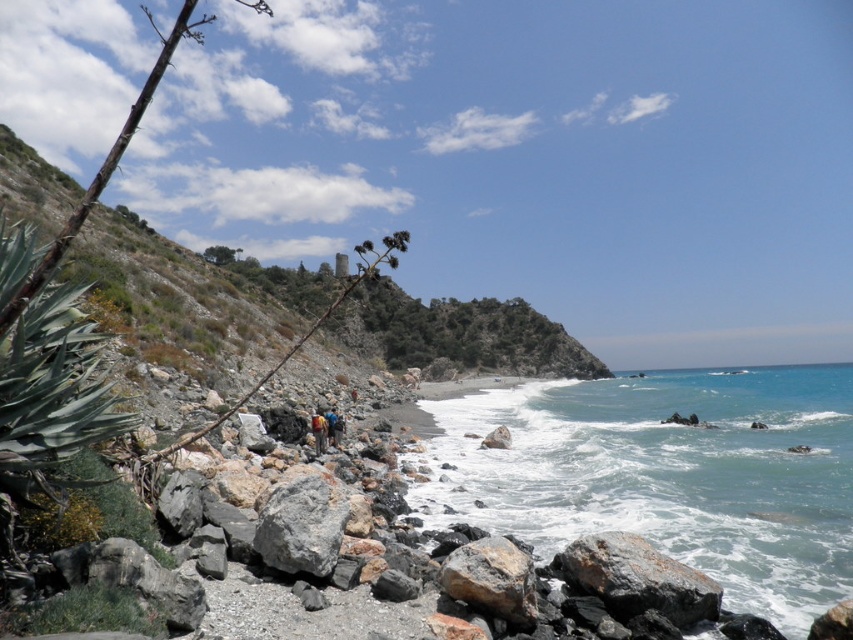
Between gray rough rock at lower center and camouflage fabric person at center, which one has less height?

With less height is camouflage fabric person at center.

Who is taller, gray rough rock at lower center or camouflage fabric person at center?

Standing taller between the two is gray rough rock at lower center.

Identify the location of gray rough rock at lower center. (637, 579).

Can you confirm if camouflage fabric person at center is wider than blue fabric backpack at center?

Yes, camouflage fabric person at center is wider than blue fabric backpack at center.

Who is more distant from viewer, (316,428) or (335,444)?

Point (335,444)

Which is in front, point (325, 442) or point (335, 412)?

Point (325, 442) is more forward.

You are a GUI agent. You are given a task and a screenshot of the screen. Output one action in this format:
    pyautogui.click(x=<x>, y=<y>)
    Task: Click on the camouflage fabric person at center
    
    Given the screenshot: What is the action you would take?
    pyautogui.click(x=318, y=432)

Is point (720, 595) positioned before point (457, 586)?

No, it is behind (457, 586).

This screenshot has height=640, width=853. Describe the element at coordinates (637, 579) in the screenshot. I see `gray rough rock at lower center` at that location.

Does point (675, 564) come behind point (509, 593)?

Yes, point (675, 564) is behind point (509, 593).

You are a GUI agent. You are given a task and a screenshot of the screen. Output one action in this format:
    pyautogui.click(x=<x>, y=<y>)
    Task: Click on the gray rough rock at lower center
    Image resolution: width=853 pixels, height=640 pixels.
    Given the screenshot: What is the action you would take?
    pyautogui.click(x=637, y=579)